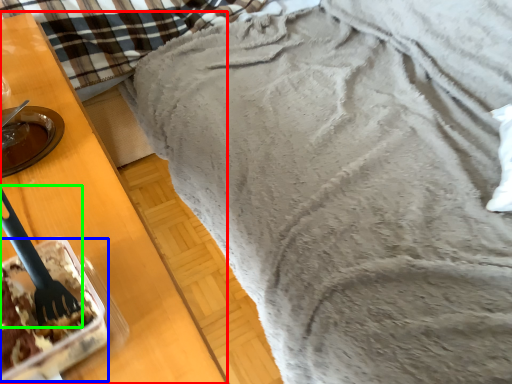
Question: Which object is positioned closest to furniture (highlighted by a red box)? Select from dessert (highlighted by a blue box) and silverware (highlighted by a green box).

Choices:
 (A) dessert
 (B) silverware

Answer: (A)